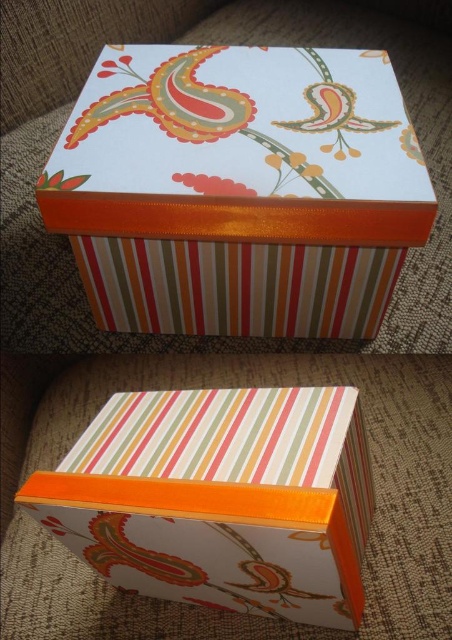
You are organizing a gift wrapping station and need to stack boxes. You have a matte paper box at center and a matte striped box at center. Which box should you place on top to ensure stability?

The matte paper box at center is already above the matte striped box at center, so to maintain stability, place the matte paper box at center on top of the matte striped box at center as shown in the arrangement.